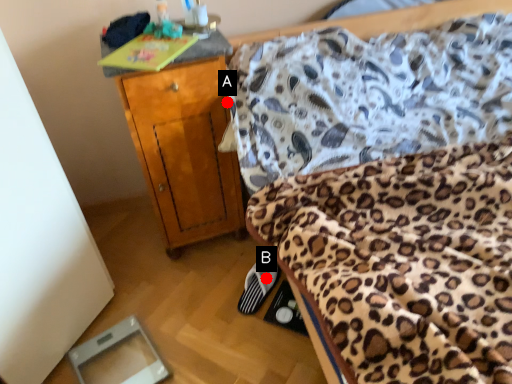
Question: Two points are circled on the image, labeled by A and B beside each circle. Which of the following is the closest to the observer?

Choices:
 (A) A is closer
 (B) B is closer

Answer: (A)